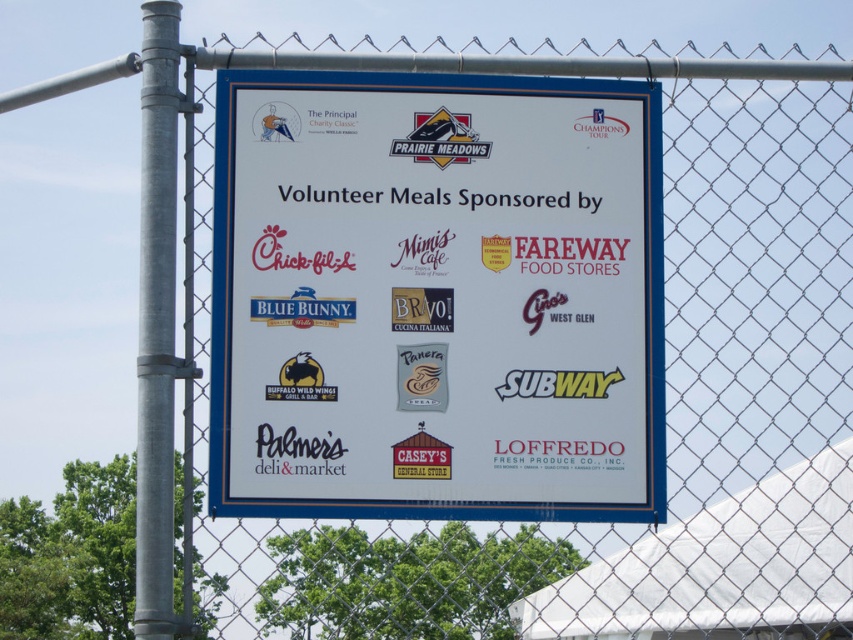
Based on the photo, can you confirm if white paper sign at center is smaller than matte red sign at center?

Actually, white paper sign at center might be larger than matte red sign at center.

Which is more to the left, white paper sign at center or matte red sign at center?

matte red sign at center is more to the left.

Does point (639, 141) come in front of point (426, 157)?

No, it is behind (426, 157).

I want to click on white paper sign at center, so click(x=436, y=300).

Between point (286, 141) and point (166, 195), which one is positioned in front?

Positioned in front is point (166, 195).

Is point (315, 476) farther from camera compared to point (154, 364)?

No, (315, 476) is closer to viewer.

Where is `white paper sign at center`? white paper sign at center is located at coordinates [436, 300].

Which of these two, galvanized metal pole at left or matte red sign at center, stands shorter?

matte red sign at center

Is galvanized metal pole at left to the left of matte red sign at center from the viewer's perspective?

Indeed, galvanized metal pole at left is positioned on the left side of matte red sign at center.

Where is `galvanized metal pole at left`? The image size is (853, 640). galvanized metal pole at left is located at coordinates (155, 323).